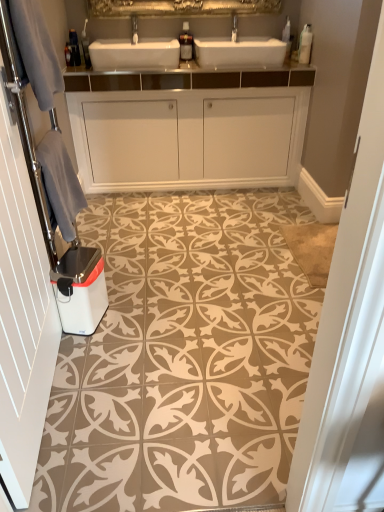
Question: Is white textured towel at left oriented away from gray fabric at left?

Choices:
 (A) no
 (B) yes

Answer: (A)

Question: Considering the relative sizes of white textured towel at left and gray fabric at left in the image provided, is white textured towel at left thinner than gray fabric at left?

Choices:
 (A) yes
 (B) no

Answer: (A)

Question: Is white textured towel at left with gray fabric at left?

Choices:
 (A) yes
 (B) no

Answer: (B)

Question: Considering the relative sizes of white textured towel at left and gray fabric at left in the image provided, is white textured towel at left smaller than gray fabric at left?

Choices:
 (A) no
 (B) yes

Answer: (A)

Question: Considering the relative sizes of white textured towel at left and gray fabric at left in the image provided, is white textured towel at left taller than gray fabric at left?

Choices:
 (A) no
 (B) yes

Answer: (B)

Question: Does white textured towel at left turn towards gray fabric at left?

Choices:
 (A) no
 (B) yes

Answer: (A)

Question: From the image's perspective, does white glossy dishwasher at lower left appear higher than brushed metal faucet at upper center?

Choices:
 (A) yes
 (B) no

Answer: (B)

Question: Can you confirm if white glossy dishwasher at lower left is bigger than brushed metal faucet at upper center?

Choices:
 (A) no
 (B) yes

Answer: (B)

Question: Is white glossy dishwasher at lower left not near brushed metal faucet at upper center?

Choices:
 (A) no
 (B) yes

Answer: (B)

Question: Is brushed metal faucet at upper center located within white glossy dishwasher at lower left?

Choices:
 (A) yes
 (B) no

Answer: (B)

Question: Can you confirm if white glossy dishwasher at lower left is smaller than brushed metal faucet at upper center?

Choices:
 (A) yes
 (B) no

Answer: (B)

Question: Would you say white glossy dishwasher at lower left is outside brushed metal faucet at upper center?

Choices:
 (A) no
 (B) yes

Answer: (B)

Question: Is white glossy dishwasher at lower left at the right side of gray fabric towel at left?

Choices:
 (A) no
 (B) yes

Answer: (B)